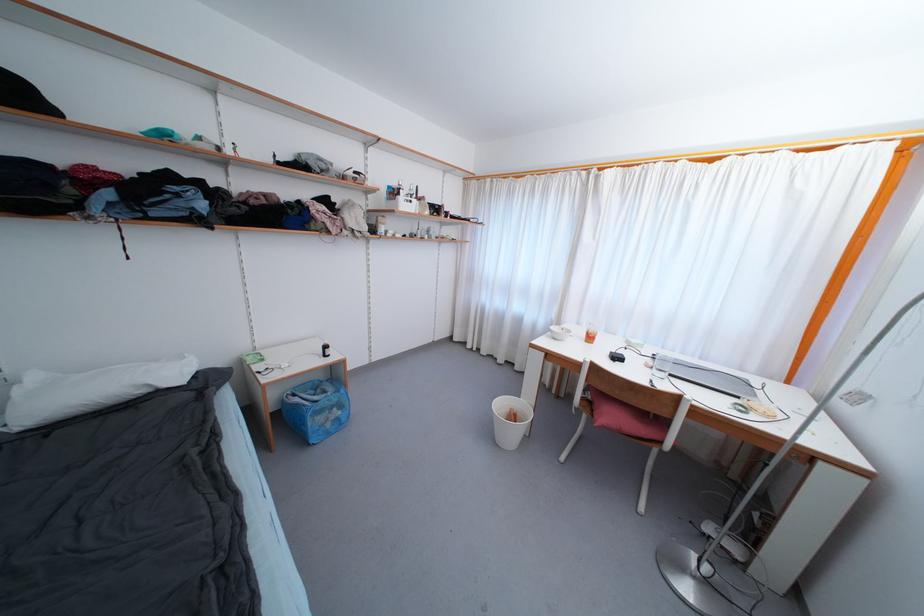
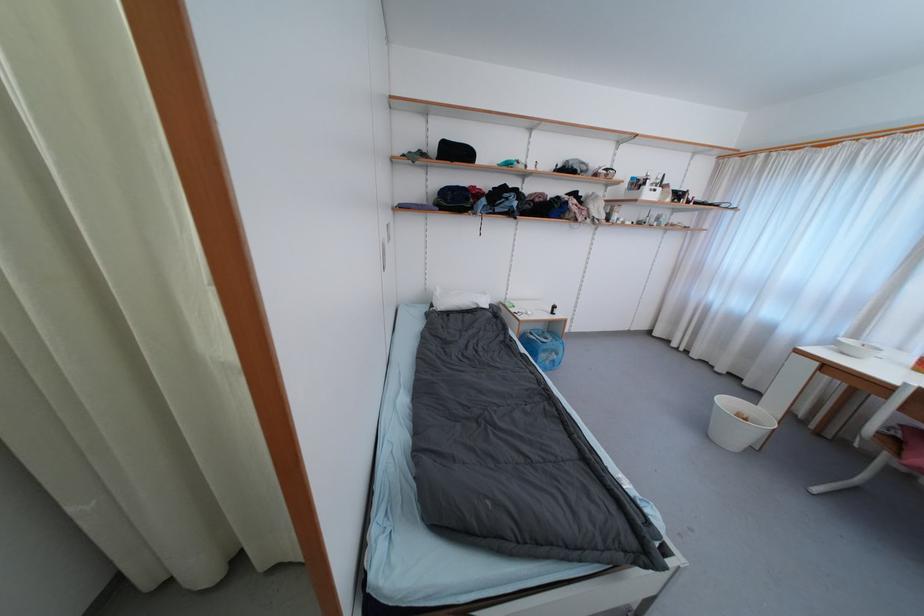
Find the pixel in the second image that matches (x=505, y=407) in the first image.

(732, 405)